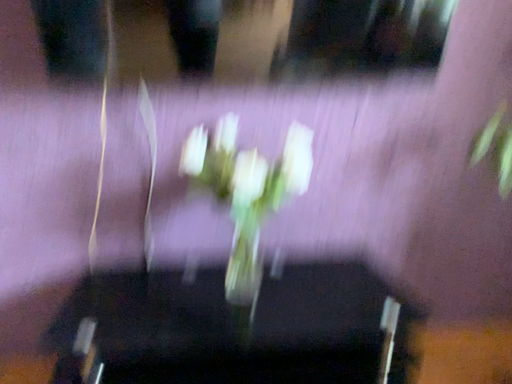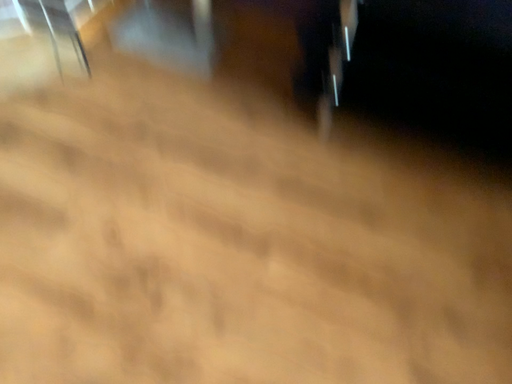
Question: Which way did the camera rotate in the video?

Choices:
 (A) rotated left
 (B) rotated right

Answer: (A)